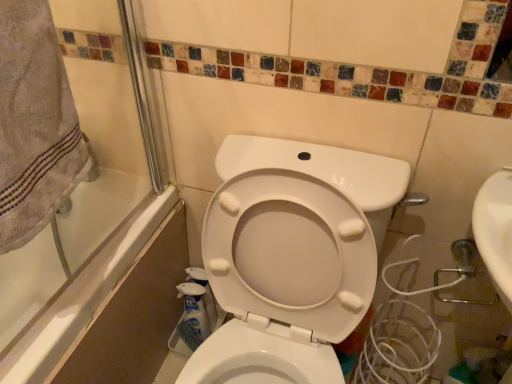
Question: Is white glossy bathtub at left taller or shorter than beige cotton towel at upper left?

Choices:
 (A) short
 (B) tall

Answer: (B)

Question: Is white glossy bathtub at left spatially inside beige cotton towel at upper left, or outside of it?

Choices:
 (A) inside
 (B) outside

Answer: (B)

Question: Estimate the real-world distances between objects in this image. Which object is farther from the beige cotton towel at upper left?

Choices:
 (A) white glossy bottle at lower center, the second cleaning product from the front
 (B) white glossy bathtub at left
 (C) translucent plastic spray bottle at lower center, the 1th cleaning product when ordered from front to back

Answer: (C)

Question: Which is nearer to the translucent plastic spray bottle at lower center, the 1th cleaning product when ordered from front to back?

Choices:
 (A) white glossy bathtub at left
 (B) beige cotton towel at upper left
 (C) white glossy bottle at lower center, marked as the first cleaning product in a back-to-front arrangement

Answer: (C)